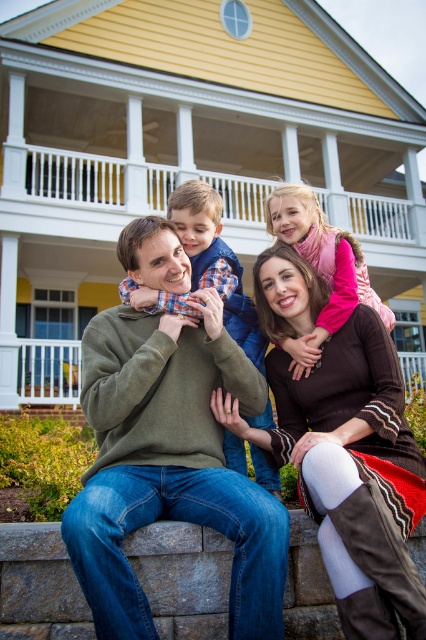
You are standing in front of the family photo taken at the two story house. There are two points marked in the image. The first point is at coordinate point (331, 593) and the second point is at coordinate point (138, 211). Which point is closer to you as you look at the photo?

Point (331, 593) is in front of point (138, 211), so it is closer to you.

Consider the image. You are a painter who needs to paint the stone ledge at lower center and the white wooden railing at upper center. Since you want to paint the lower parts first, which object should you start with?

The stone ledge at lower center is below the white wooden railing at upper center, so you should start painting the stone ledge at lower center first.